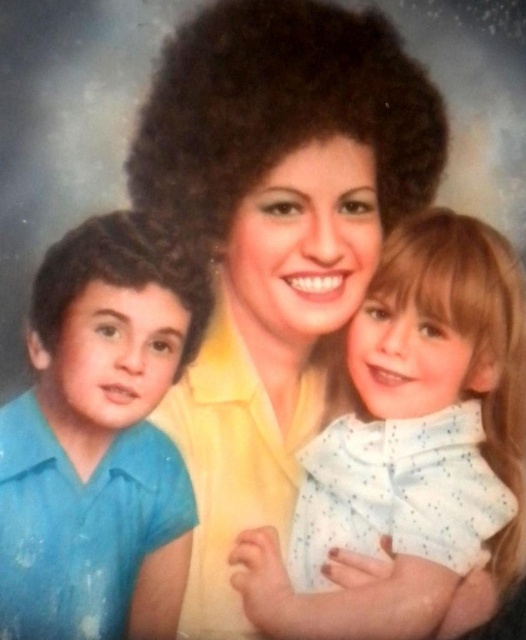
Question: Is white dotted shirt at center below blue cotton shirt at left?

Choices:
 (A) no
 (B) yes

Answer: (B)

Question: Can you confirm if white dotted shirt at center is positioned to the left of blue cotton shirt at left?

Choices:
 (A) yes
 (B) no

Answer: (B)

Question: Which object is closer to the camera taking this photo?

Choices:
 (A) yellow matte shirt at center
 (B) white dotted shirt at center
 (C) blue cotton shirt at left

Answer: (C)

Question: Estimate the real-world distances between objects in this image. Which object is closer to the yellow matte shirt at center?

Choices:
 (A) white dotted shirt at center
 (B) blue cotton shirt at left

Answer: (B)

Question: Is white dotted shirt at center to the left of blue cotton shirt at left from the viewer's perspective?

Choices:
 (A) no
 (B) yes

Answer: (A)

Question: Which of these objects is positioned farthest from the yellow matte shirt at center?

Choices:
 (A) blue cotton shirt at left
 (B) white dotted shirt at center

Answer: (B)